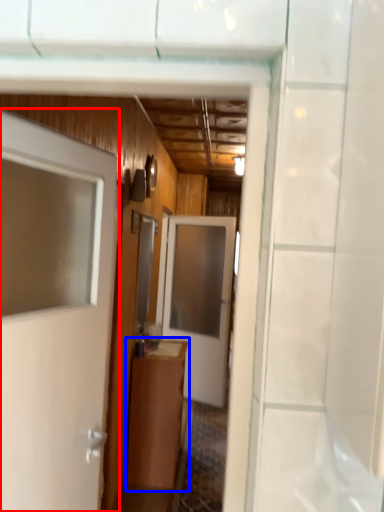
Question: Among these objects, which one is farthest to the camera, door (highlighted by a red box) or cabinetry (highlighted by a blue box)?

Choices:
 (A) door
 (B) cabinetry

Answer: (B)